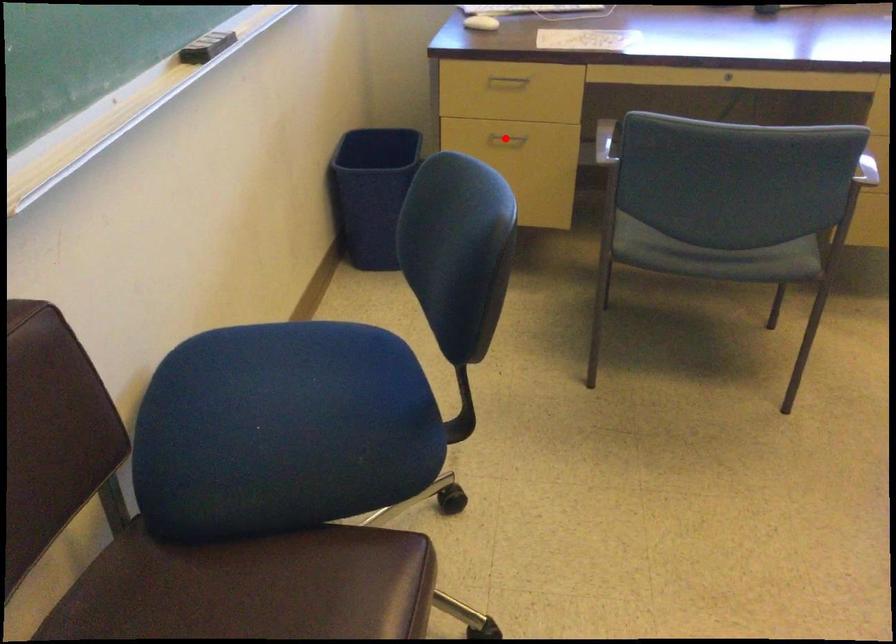
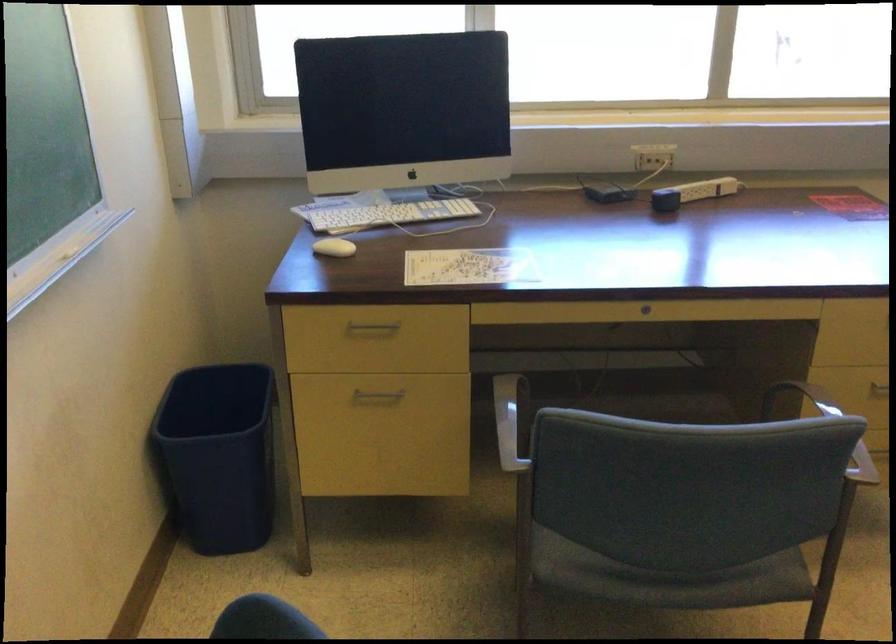
Question: I am providing you with two images of the same scene from different viewpoints. In image1, a red point is highlighted. Considering the same 3D point in image2, which of the following is correct?

Choices:
 (A) It is closer
 (B) It is farther

Answer: (A)